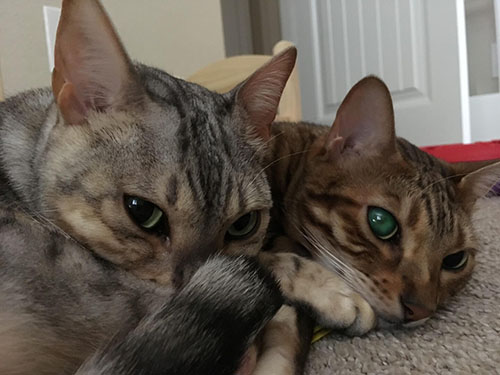
Identify the location of door. (379, 51).